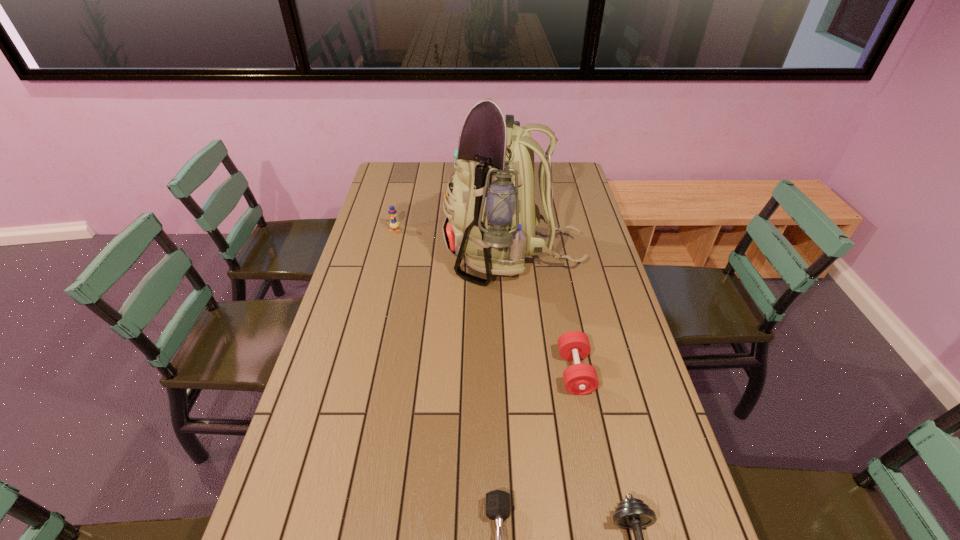
Where is `dumbbell that can be found as the closest to the shortest dumbbell`? The width and height of the screenshot is (960, 540). dumbbell that can be found as the closest to the shortest dumbbell is located at coordinates (633, 514).

This screenshot has width=960, height=540. I want to click on free space in the image that satisfies the following two spatial constraints: 1. on the back side of the farthest dumbbell; 2. on the front-facing side of the backpack, so click(x=552, y=255).

Where is `blank space that satisfies the following two spatial constraints: 1. on the front-facing side of the third farthest object; 2. on the right side of the backpack`? blank space that satisfies the following two spatial constraints: 1. on the front-facing side of the third farthest object; 2. on the right side of the backpack is located at coordinates (523, 372).

Where is `free location that satisfies the following two spatial constraints: 1. on the front-facing side of the third farthest object; 2. on the right side of the tallest object`? The width and height of the screenshot is (960, 540). free location that satisfies the following two spatial constraints: 1. on the front-facing side of the third farthest object; 2. on the right side of the tallest object is located at coordinates (523, 372).

Image resolution: width=960 pixels, height=540 pixels. Find the location of `free point that satisfies the following two spatial constraints: 1. on the face of the duckling, where the monocle is placed; 2. on the left side of the third farthest object`. free point that satisfies the following two spatial constraints: 1. on the face of the duckling, where the monocle is placed; 2. on the left side of the third farthest object is located at coordinates (360, 372).